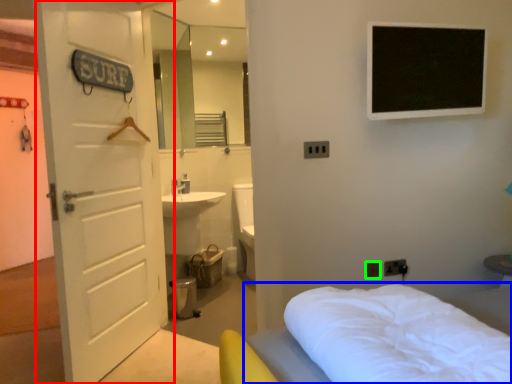
Question: Which object is positioned closest to door (highlighted by a red box)? Select from bed (highlighted by a blue box) and electric outlet (highlighted by a green box).

Choices:
 (A) bed
 (B) electric outlet

Answer: (A)